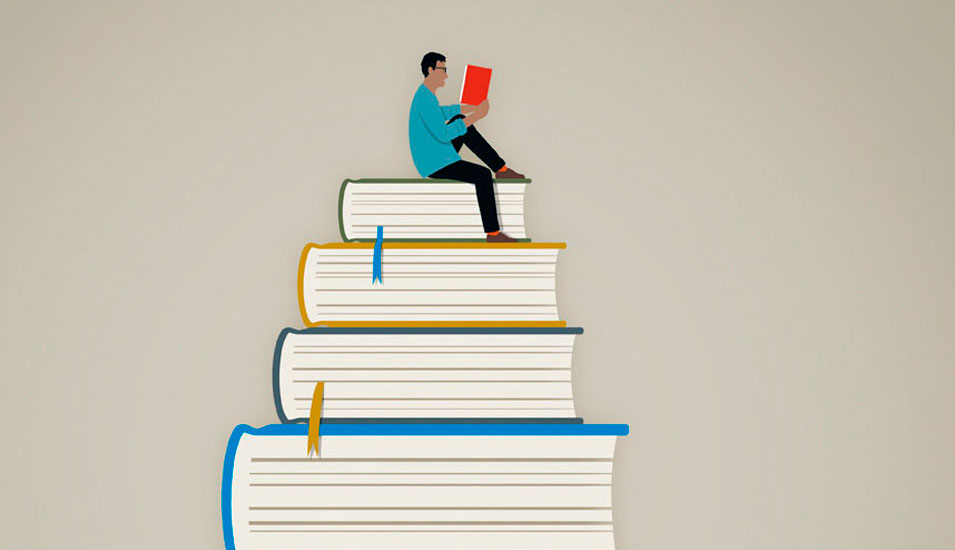
Locate an element on the screen. This screenshot has width=955, height=550. book is located at coordinates (447, 488), (451, 380), (453, 283), (436, 211), (475, 82).